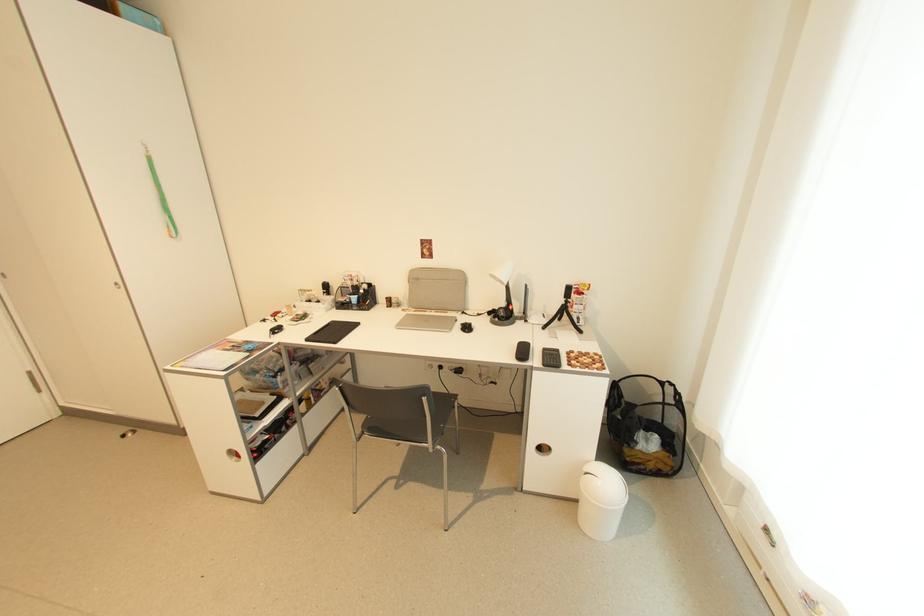
The location [577,300] corresponds to which object?

This point indicates the small black tripod.